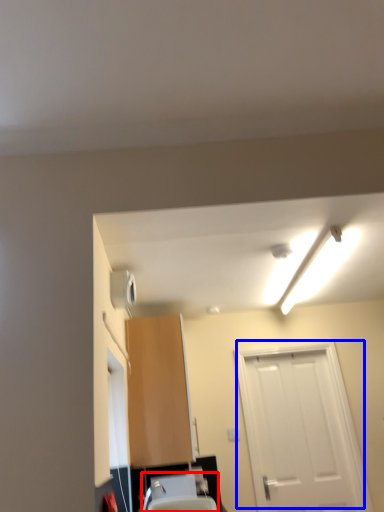
Question: Which of the following is the farthest to the observer, sink (highlighted by a red box) or door (highlighted by a blue box)?

Choices:
 (A) sink
 (B) door

Answer: (B)